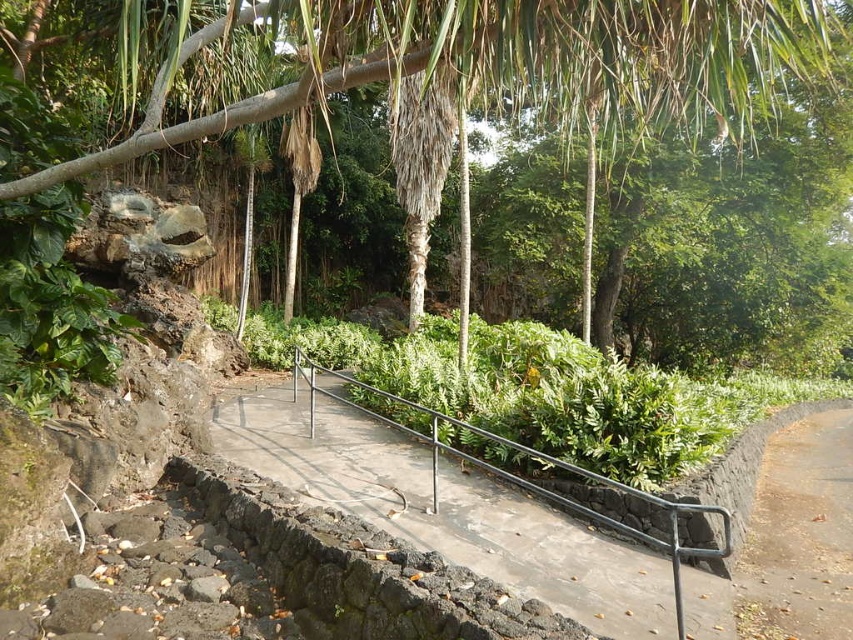
You are standing at the camera position and want to take a photo of both point (479, 65) and point (834, 508) in the scene. Which point will appear larger in your photo?

Point (479, 65) will appear larger in the photo because it is closer to the camera than point (834, 508).

You are a gardener planning to plant a new tree in the center of the pathway. The existing green leafy tree at center and the concrete at center are already there. Considering their widths, which object will require more space to accommodate the new tree?

The green leafy tree at center has a larger width than the concrete at center, so it will require more space to accommodate the new tree.